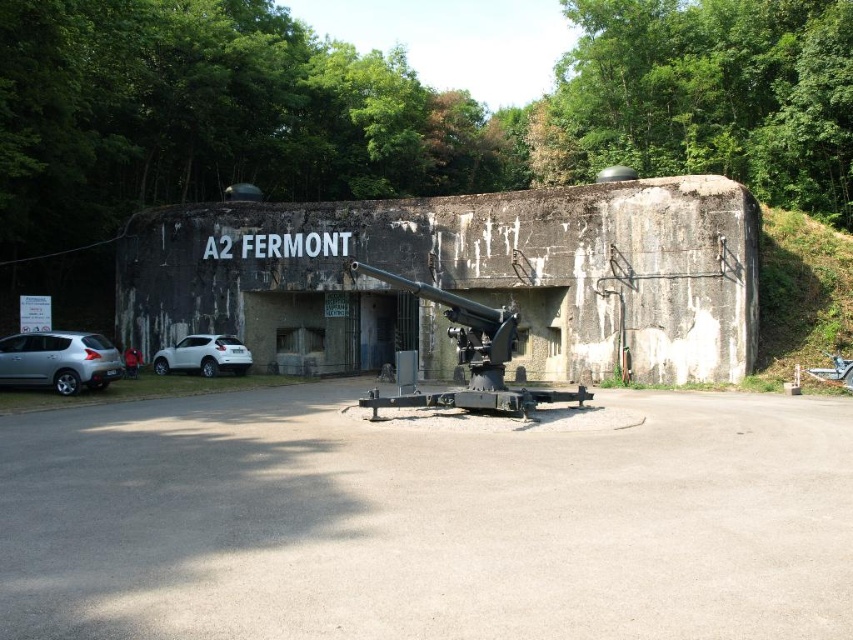
You are a delivery driver approaching the fortified structure labeled A2 FERMONT. You need to park your vehicle in the parking lot near the entrance. Which car, the satin silver car at lower left or the white matte suv at lower left, is positioned closer to the entrance so you can park behind it?

The satin silver car at lower left is closer to the viewer than the white matte suv at lower left, so it is positioned closer to the entrance. You can park behind the satin silver car at lower left.

You are a delivery driver who needs to park your truck, which is 2 meters tall, in the parking lot near the A2 FERMONT building. You see the satin silver car at lower left and the white matte suv at lower left. Can your truck fit between them without hitting the roof?

The satin silver car at lower left is taller than the white matte suv at lower left. Since your truck is 2 meters tall, you need to ensure there is enough vertical clearance. However, the exact height of the cars isn not provided, so it is uncertain if the truck can fit without hitting the roof.